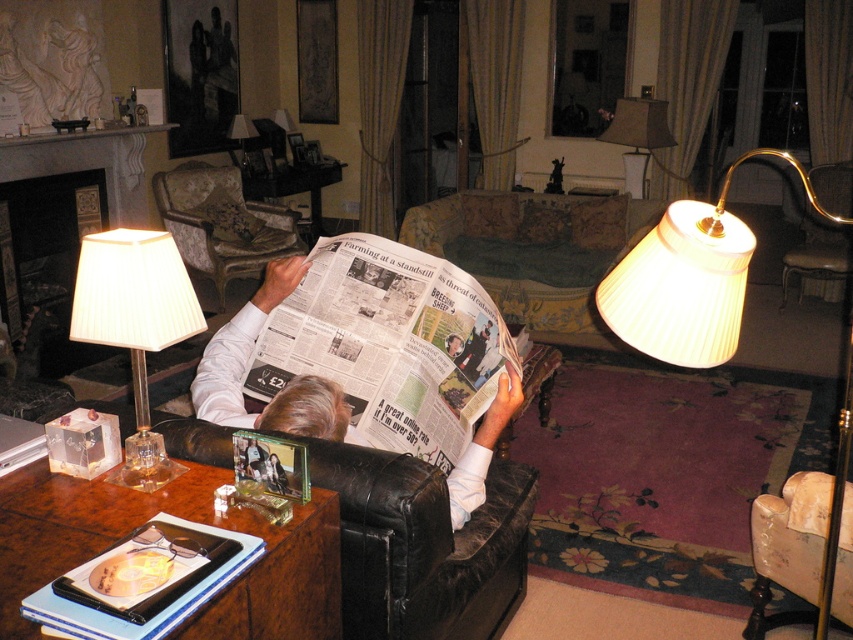
Does green fabric couch at center have a smaller size compared to gold polished metal armchair at right?

No.

Between green fabric couch at center and gold polished metal armchair at right, which one is positioned lower?

green fabric couch at center

Who is more forward, (509, 262) or (782, 273)?

Point (509, 262)

This screenshot has height=640, width=853. I want to click on green fabric couch at center, so click(x=535, y=252).

How far apart are light pink fabric armchair at lower right and white leather couch at center?

A distance of 35.29 inches exists between light pink fabric armchair at lower right and white leather couch at center.

Is light pink fabric armchair at lower right wider than white leather couch at center?

Indeed, light pink fabric armchair at lower right has a greater width compared to white leather couch at center.

Which is behind, point (788, 483) or point (320, 408)?

Positioned behind is point (788, 483).

Image resolution: width=853 pixels, height=640 pixels. Identify the location of light pink fabric armchair at lower right. (788, 545).

Which is more to the right, white pleated lampshade at upper right or white leather couch at center?

white pleated lampshade at upper right is more to the right.

How distant is white pleated lampshade at upper right from white leather couch at center?

30.00 inches

What are the coordinates of `white pleated lampshade at upper right` in the screenshot? It's located at (689, 278).